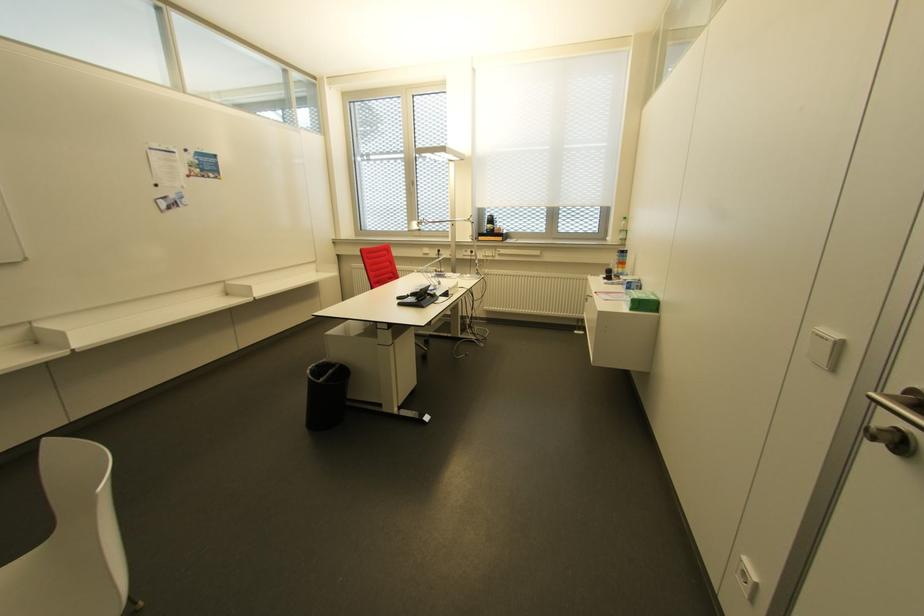
The width and height of the screenshot is (924, 616). I want to click on metal door handle, so click(x=902, y=405).